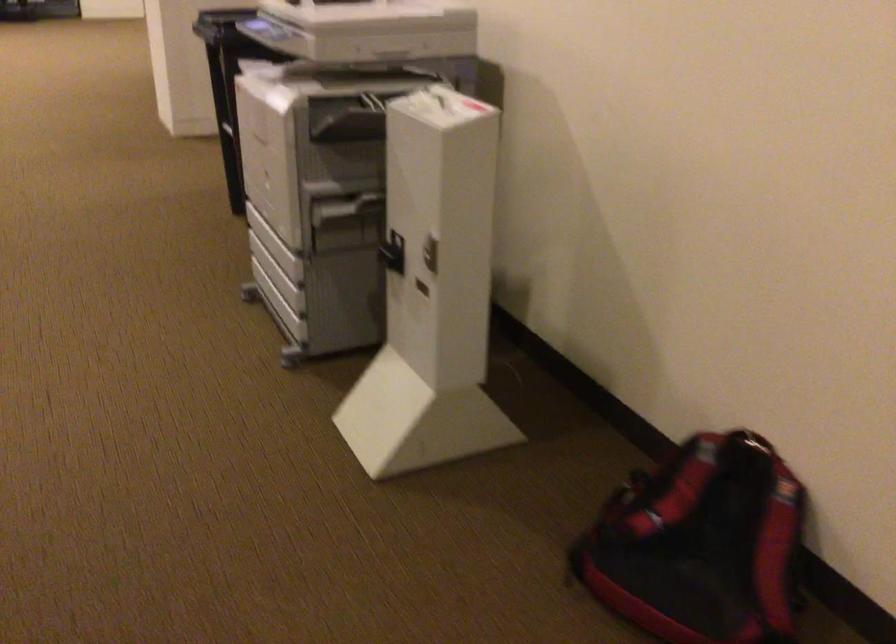
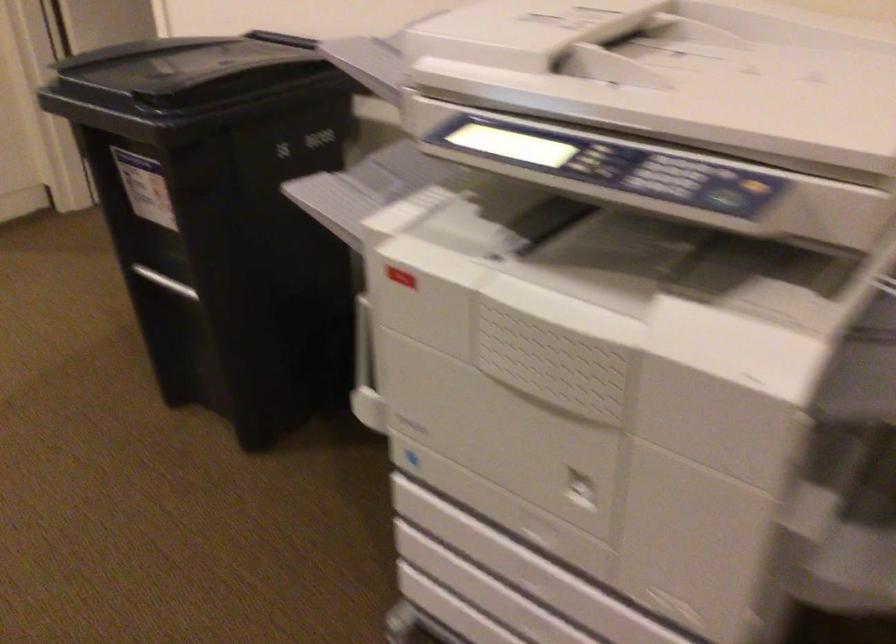
In a continuous first-person perspective shot, in which direction is the camera moving?

The movement direction of the cameraman is left, forward.